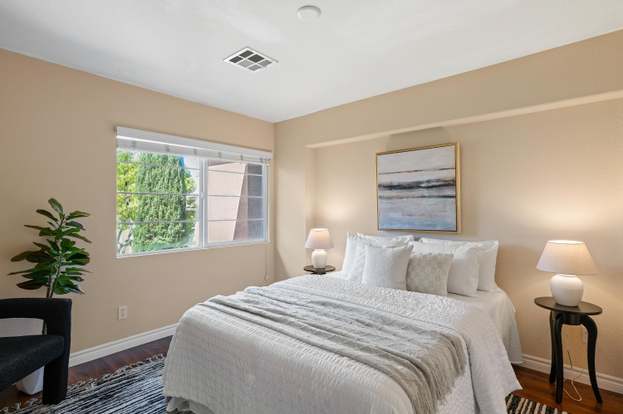
Image resolution: width=623 pixels, height=414 pixels. In order to click on sides of frame in this screenshot , I will do `click(374, 197)`, `click(421, 232)`, `click(458, 202)`, `click(416, 148)`.